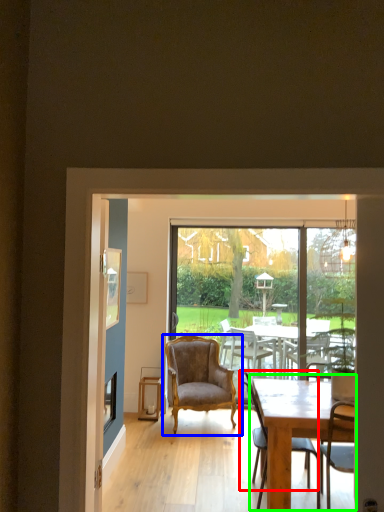
Question: Which object is positioned farthest from chair (highlighted by a red box)? Select from chair (highlighted by a blue box) and round table (highlighted by a green box).

Choices:
 (A) chair
 (B) round table

Answer: (A)